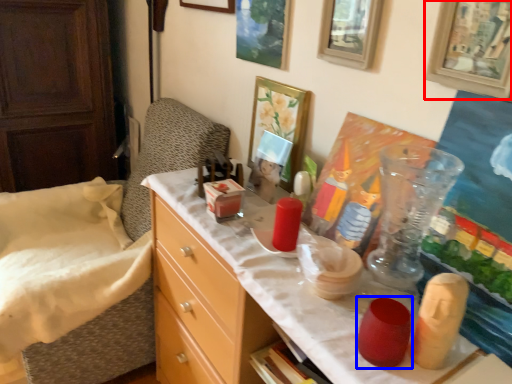
Question: Which point is further to the camera, picture frame (highlighted by a red box) or candle holder (highlighted by a blue box)?

Choices:
 (A) picture frame
 (B) candle holder

Answer: (B)